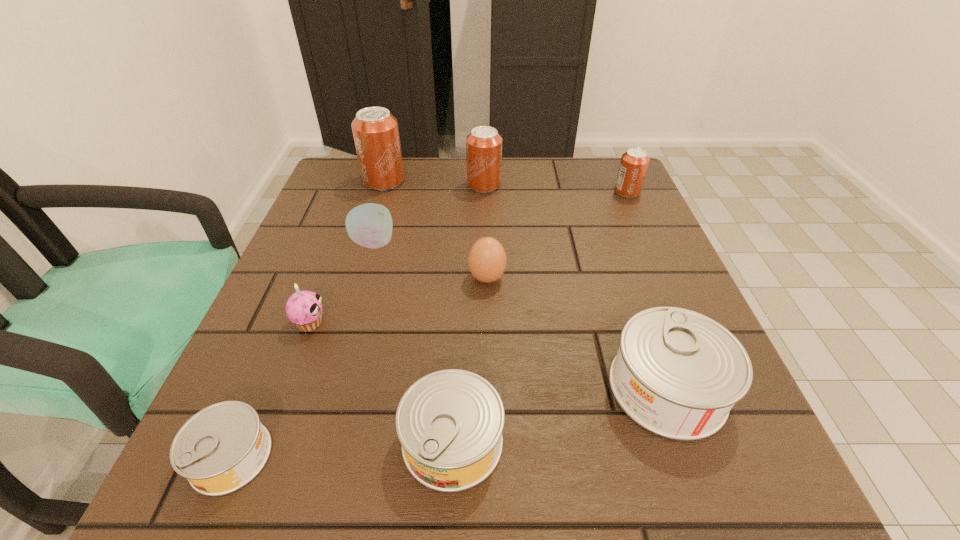
In order to click on free space located 0.280m on the face of the sixth farthest object in this screenshot , I will do `click(483, 323)`.

Find the location of a particular element. The height and width of the screenshot is (540, 960). vacant region located on the back of the biggest silver can is located at coordinates (615, 244).

Where is `free space located 0.150m on the back of the second shortest object`? The width and height of the screenshot is (960, 540). free space located 0.150m on the back of the second shortest object is located at coordinates (458, 322).

The image size is (960, 540). What are the coordinates of `free spot located 0.100m on the back of the leftmost silver can` in the screenshot? It's located at (270, 364).

Where is `apple situated at the left edge`? The width and height of the screenshot is (960, 540). apple situated at the left edge is located at coordinates (370, 225).

Find the location of a particular element. This screenshot has width=960, height=540. cupcake that is at the left edge is located at coordinates (304, 308).

At what (x,y) coordinates should I click in order to perform the action: click on object present at the far left corner. Please return your answer as a coordinate pair (x, y). This screenshot has height=540, width=960. Looking at the image, I should click on (375, 130).

The image size is (960, 540). I want to click on object present at the near left corner, so [x=223, y=447].

At what (x,y) coordinates should I click in order to perform the action: click on object at the far right corner. Please return your answer as a coordinate pair (x, y). This screenshot has width=960, height=540. Looking at the image, I should click on (634, 162).

Identify the location of free space at the far edge of the desktop. (435, 201).